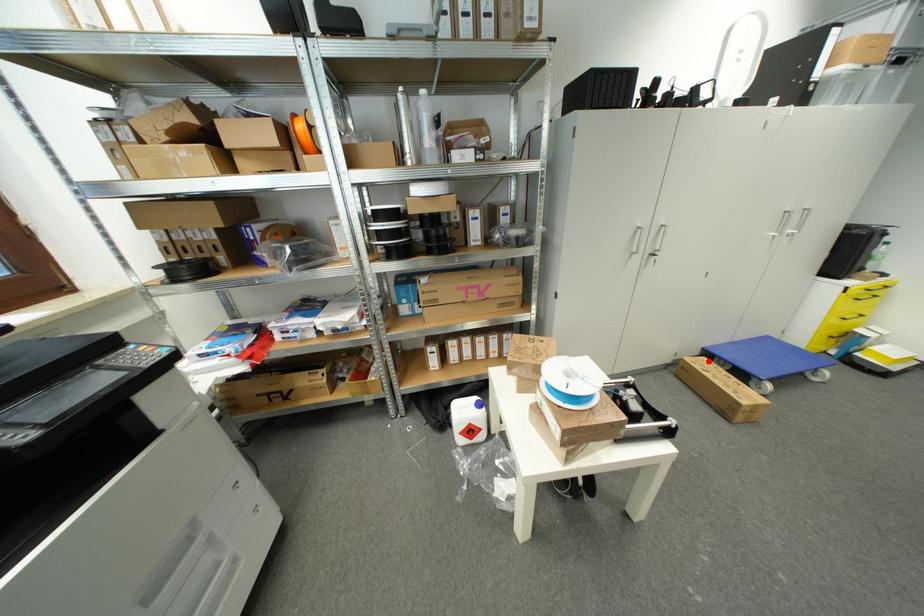
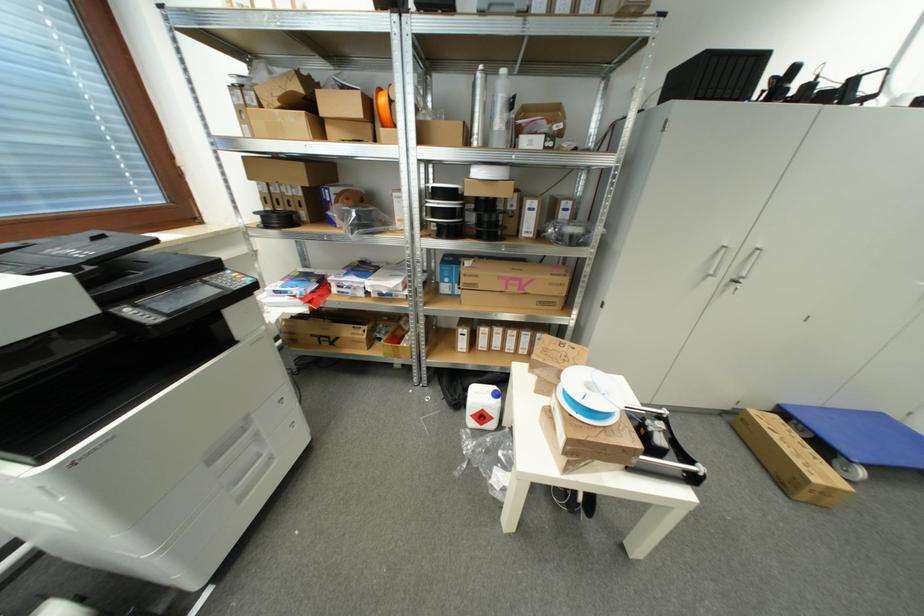
Question: I am providing you with two images of the same scene from different viewpoints. In image1, a red point is highlighted. Considering the same 3D point in image2, which of the following is correct?

Choices:
 (A) It is closer
 (B) It is farther

Answer: (B)